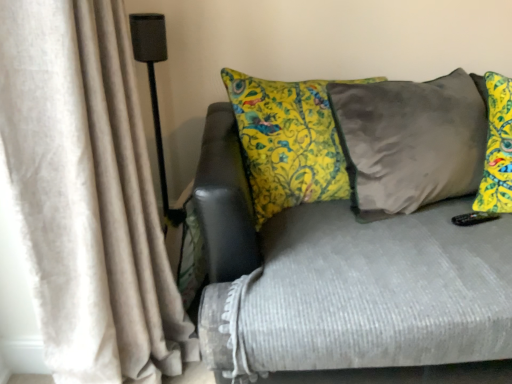
Question: Is point (373, 350) positioned closer to the camera than point (141, 377)?

Choices:
 (A) closer
 (B) farther

Answer: (A)

Question: From a real-world perspective, is textured gray couch at center physically located above or below beige velvet curtain at left?

Choices:
 (A) above
 (B) below

Answer: (B)

Question: Based on their relative distances, which object is farther from the beige velvet curtain at left?

Choices:
 (A) black matte speaker at left
 (B) textured gray couch at center

Answer: (A)

Question: Which object is positioned farthest from the black matte speaker at left?

Choices:
 (A) textured gray couch at center
 (B) beige velvet curtain at left

Answer: (A)